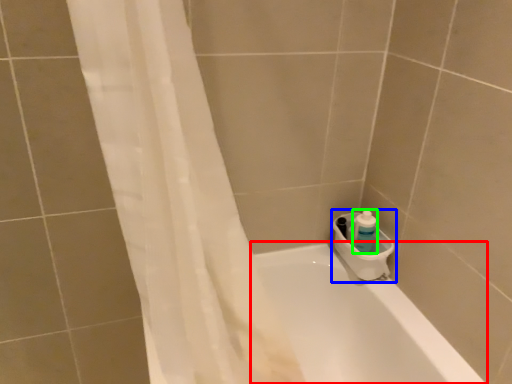
Question: Which object is positioned farthest from bathtub (highlighted by a red box)? Select from sink (highlighted by a blue box) and cleaning product (highlighted by a green box).

Choices:
 (A) sink
 (B) cleaning product

Answer: (B)